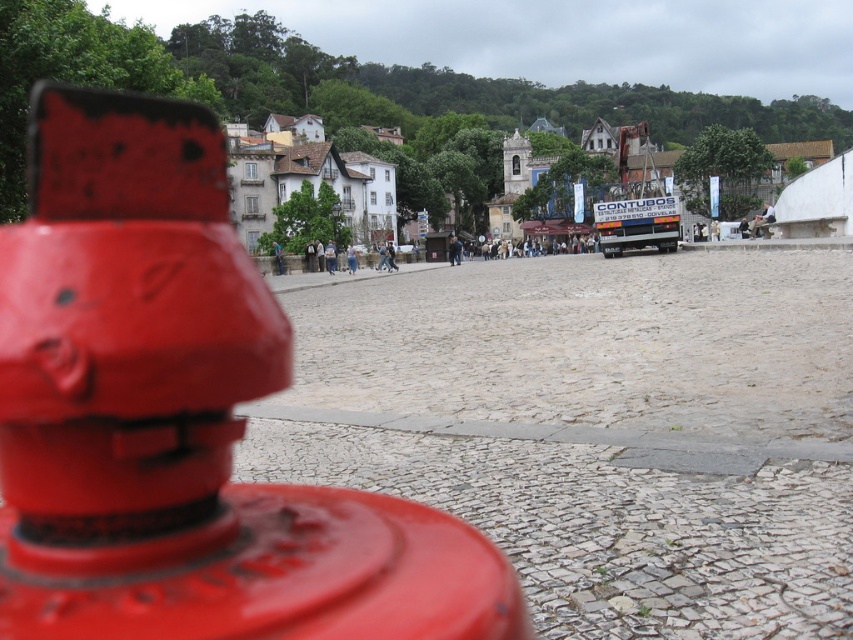
Find the location of a particular element. matte red hydrant at center is located at coordinates (180, 417).

Who is lower down, matte red hydrant at center or white stone buildings at center?

matte red hydrant at center is lower down.

Where is `matte red hydrant at center`? This screenshot has width=853, height=640. matte red hydrant at center is located at coordinates (180, 417).

Where is `matte red hydrant at center`? This screenshot has height=640, width=853. matte red hydrant at center is located at coordinates (180, 417).